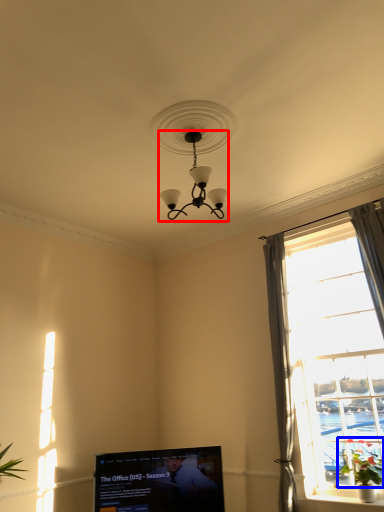
Question: Which object is further to the camera taking this photo, lamp (highlighted by a red box) or plant (highlighted by a blue box)?

Choices:
 (A) lamp
 (B) plant

Answer: (B)